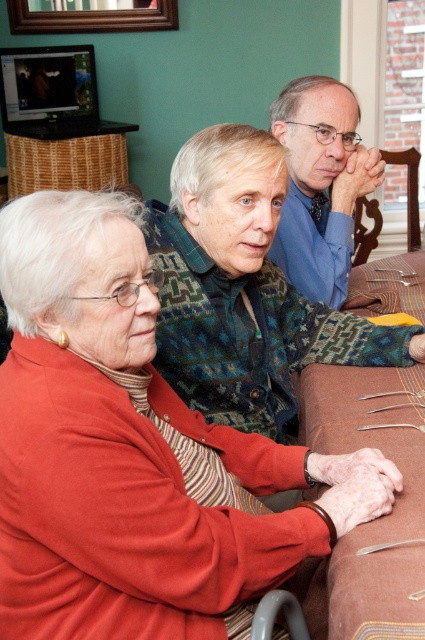
Question: Which point appears closest to the camera in this image?

Choices:
 (A) click(x=323, y=198)
 (B) click(x=176, y=540)
 (C) click(x=385, y=531)

Answer: (B)

Question: Can you confirm if matte red sweater at center is positioned to the left of brown fabric table at center?

Choices:
 (A) no
 (B) yes

Answer: (B)

Question: Which point is farther to the camera?

Choices:
 (A) (385, 483)
 (B) (331, 243)
 (C) (370, 634)

Answer: (B)

Question: Can you confirm if matte red sweater at center is bigger than blue smooth shirt at upper center?

Choices:
 (A) yes
 (B) no

Answer: (A)

Question: Is matte red sweater at center wider than blue smooth shirt at upper center?

Choices:
 (A) yes
 (B) no

Answer: (A)

Question: Which point is farther to the camera?

Choices:
 (A) blue smooth shirt at upper center
 (B) brown fabric table at center
 (C) matte red sweater at center

Answer: (A)